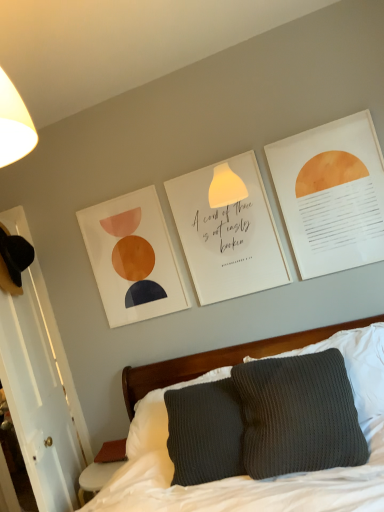
Question: From the image's perspective, would you say matte orange circle at upper right, the first postcard viewed from the front, is shown under white paper at center, arranged as the first postcard when viewed from the left?

Choices:
 (A) yes
 (B) no

Answer: (B)

Question: From a real-world perspective, does matte orange circle at upper right, the 1th postcard from the right, sit lower than white paper at center, the second postcard in the front-to-back sequence?

Choices:
 (A) yes
 (B) no

Answer: (B)

Question: Does matte orange circle at upper right, the 1th postcard from the right, come behind white paper at center, the 1th postcard positioned from the back?

Choices:
 (A) no
 (B) yes

Answer: (A)

Question: Is matte orange circle at upper right, acting as the 2th postcard starting from the left, not inside white paper at center, the second postcard from the right?

Choices:
 (A) yes
 (B) no

Answer: (A)

Question: From the image's perspective, is matte orange circle at upper right, placed as the second postcard when sorted from back to front, over white paper at center, the second postcard in the front-to-back sequence?

Choices:
 (A) yes
 (B) no

Answer: (A)

Question: Considering the relative sizes of matte orange circle at upper right, placed as the second postcard when sorted from back to front, and white paper at center, the 1th postcard positioned from the back, in the image provided, is matte orange circle at upper right, placed as the second postcard when sorted from back to front, bigger than white paper at center, the 1th postcard positioned from the back,?

Choices:
 (A) yes
 (B) no

Answer: (A)

Question: Can you confirm if matte orange circle at upper right, the first postcard viewed from the front, is wider than knitted gray pillow at center?

Choices:
 (A) no
 (B) yes

Answer: (A)

Question: Would you say matte orange circle at upper right, acting as the 2th postcard starting from the left, contains knitted gray pillow at center?

Choices:
 (A) no
 (B) yes

Answer: (A)

Question: Can you confirm if matte orange circle at upper right, placed as the second postcard when sorted from back to front, is shorter than knitted gray pillow at center?

Choices:
 (A) yes
 (B) no

Answer: (B)

Question: From the image's perspective, does matte orange circle at upper right, acting as the 2th postcard starting from the left, appear higher than knitted gray pillow at center?

Choices:
 (A) yes
 (B) no

Answer: (A)

Question: Is matte orange circle at upper right, placed as the second postcard when sorted from back to front, facing away from knitted gray pillow at center?

Choices:
 (A) no
 (B) yes

Answer: (A)

Question: Does matte orange circle at upper right, acting as the 2th postcard starting from the left, come in front of knitted gray pillow at center?

Choices:
 (A) yes
 (B) no

Answer: (B)

Question: Is knitted gray pillow at center completely or partially outside of matte paper picture frame at upper center?

Choices:
 (A) yes
 (B) no

Answer: (A)